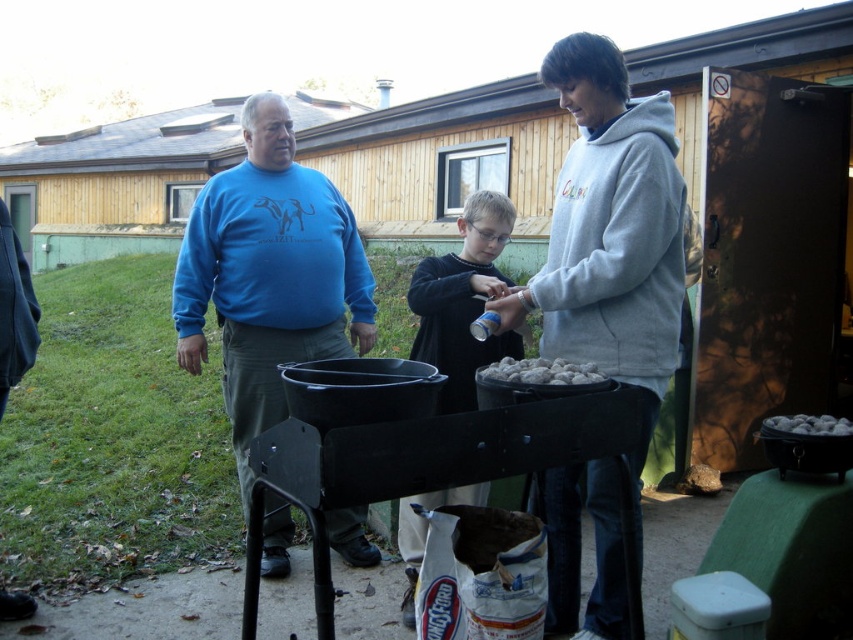
Question: Based on their relative distances, which object is nearer to the dark blue sweater at center?

Choices:
 (A) gray matte rocks at lower right
 (B) blue fleece sweater at upper left

Answer: (B)

Question: Observing the image, what is the correct spatial positioning of dark blue sweater at center in reference to white pebbles at center?

Choices:
 (A) left
 (B) right

Answer: (A)

Question: Estimate the real-world distances between objects in this image. Which object is closer to the dark blue sweater at center?

Choices:
 (A) white pebbles at center
 (B) blue fleece sweater at upper left
 (C) gray fleece hoodie at center
 (D) blue cotton shirt at center

Answer: (B)

Question: Which point is farther from the camera taking this photo?

Choices:
 (A) (577, 372)
 (B) (643, 243)

Answer: (B)

Question: Is blue fleece sweater at upper left wider than blue cotton shirt at center?

Choices:
 (A) no
 (B) yes

Answer: (B)

Question: Can you confirm if dark blue sweater at center is thinner than white pebbles at center?

Choices:
 (A) no
 (B) yes

Answer: (A)